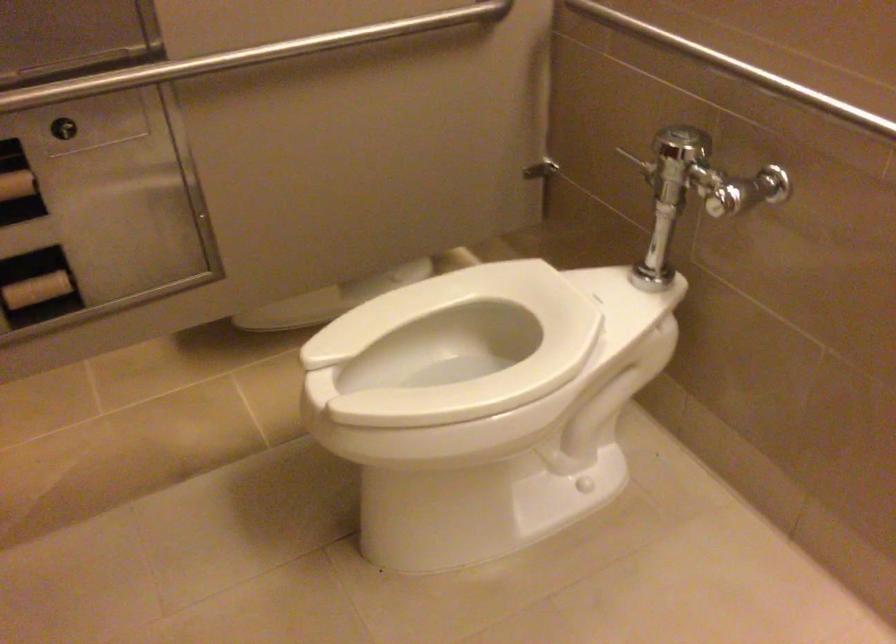
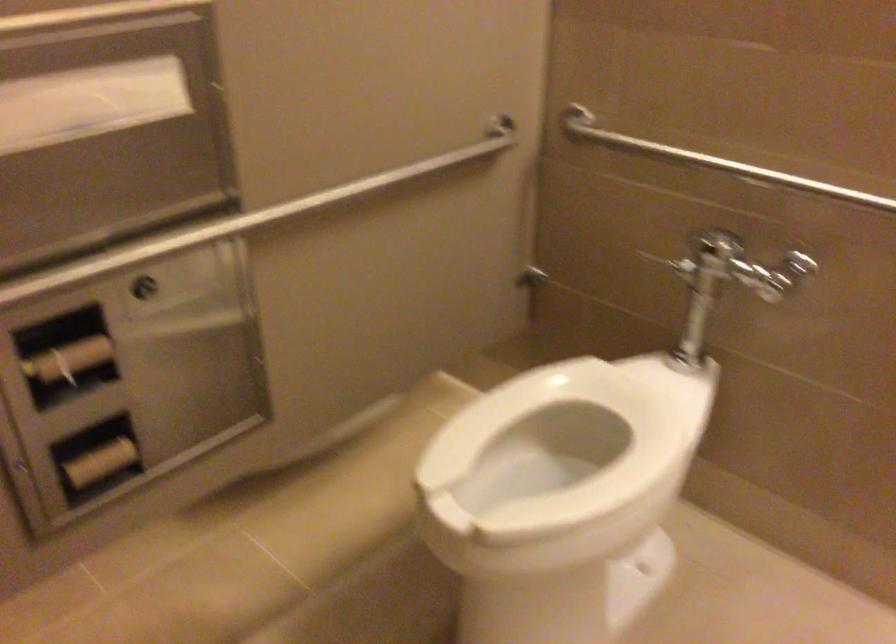
Where in the second image is the point corresponding to (x=661, y=163) from the first image?

(703, 260)